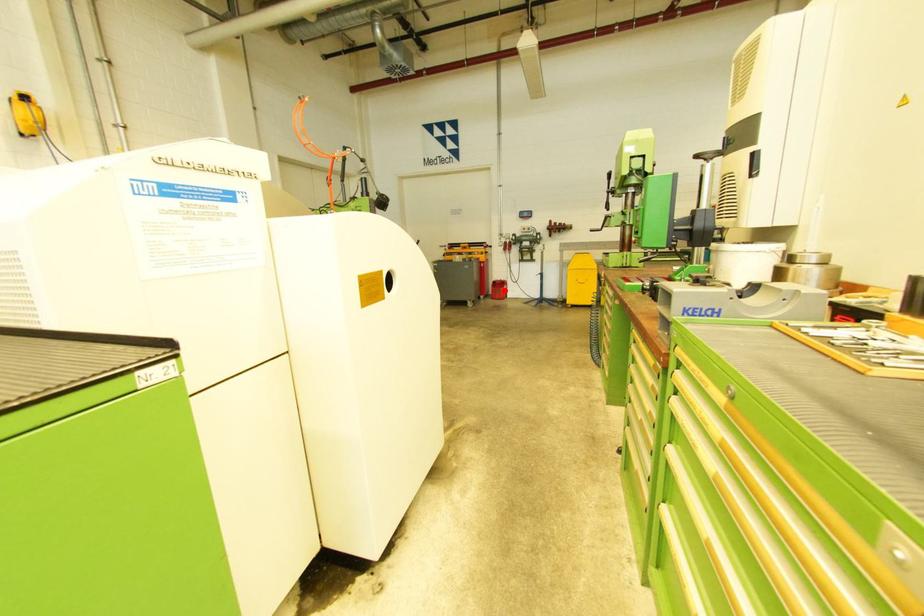
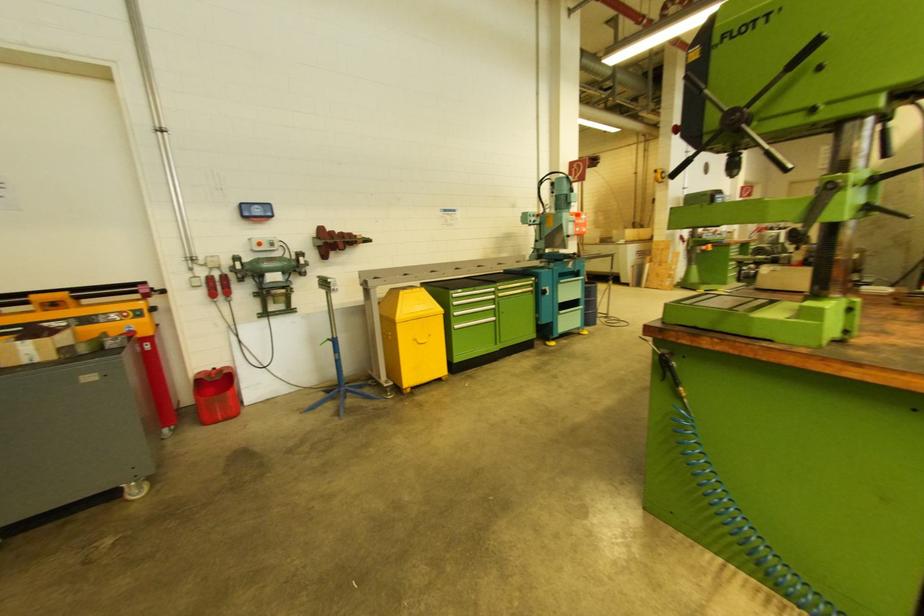
The point at the highlighted location is marked in the first image. Where is the corresponding point in the second image?

(229, 394)